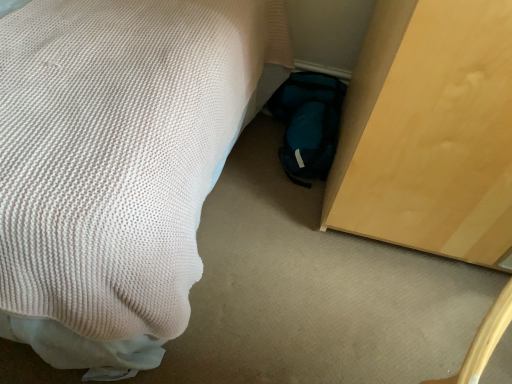
The width and height of the screenshot is (512, 384). Describe the element at coordinates (117, 166) in the screenshot. I see `white knitted bed at lower left` at that location.

Identify the location of white knitted bed at lower left. (117, 166).

What is the approximate width of white knitted bed at lower left?

white knitted bed at lower left is 1.38 meters wide.

Describe the element at coordinates (308, 123) in the screenshot. This screenshot has height=384, width=512. I see `teal fabric bag at lower center` at that location.

The width and height of the screenshot is (512, 384). What are the coordinates of `teal fabric bag at lower center` in the screenshot? It's located at (308, 123).

Where is `white knitted bed at lower left`? Image resolution: width=512 pixels, height=384 pixels. white knitted bed at lower left is located at coordinates (117, 166).

In the image, is white knitted bed at lower left on the left side or the right side of teal fabric bag at lower center?

From the image, it's evident that white knitted bed at lower left is to the left of teal fabric bag at lower center.

Is white knitted bed at lower left further to the viewer compared to teal fabric bag at lower center?

No, white knitted bed at lower left is in front of teal fabric bag at lower center.

Which is less distant, (29, 212) or (283, 159)?

Positioned in front is point (29, 212).

From the image's perspective, which one is positioned higher, white knitted bed at lower left or teal fabric bag at lower center?

white knitted bed at lower left appears higher in the image.

From a real-world perspective, is white knitted bed at lower left positioned above or below teal fabric bag at lower center?

From a real-world perspective, white knitted bed at lower left is physically above teal fabric bag at lower center.

Which object is thinner, white knitted bed at lower left or teal fabric bag at lower center?

With smaller width is teal fabric bag at lower center.

Which of these two, white knitted bed at lower left or teal fabric bag at lower center, stands taller?

With more height is white knitted bed at lower left.

Considering the relative sizes of white knitted bed at lower left and teal fabric bag at lower center in the image provided, is white knitted bed at lower left smaller than teal fabric bag at lower center?

No.

Consider the image. Is white knitted bed at lower left not within teal fabric bag at lower center?

Yes, white knitted bed at lower left is not within teal fabric bag at lower center.

Are white knitted bed at lower left and teal fabric bag at lower center located far from each other?

No.

Could you tell me if white knitted bed at lower left is facing teal fabric bag at lower center?

Yes, white knitted bed at lower left is turned towards teal fabric bag at lower center.

Identify the location of bed lying in front of the teal fabric bag at lower center. The image size is (512, 384). point(117,166).

Which object is positioned more to the left, teal fabric bag at lower center or white knitted bed at lower left?

From the viewer's perspective, white knitted bed at lower left appears more on the left side.

Is teal fabric bag at lower center positioned before white knitted bed at lower left?

No, it is behind white knitted bed at lower left.

Is point (314, 94) closer to viewer compared to point (178, 215)?

No, it is not.

From the image's perspective, who appears lower, teal fabric bag at lower center or white knitted bed at lower left?

teal fabric bag at lower center, from the image's perspective.

From a real-world perspective, which is physically below, teal fabric bag at lower center or white knitted bed at lower left?

teal fabric bag at lower center, from a real-world perspective.

Considering the relative sizes of teal fabric bag at lower center and white knitted bed at lower left in the image provided, is teal fabric bag at lower center thinner than white knitted bed at lower left?

Indeed, teal fabric bag at lower center has a lesser width compared to white knitted bed at lower left.

Is teal fabric bag at lower center taller than white knitted bed at lower left?

No, teal fabric bag at lower center is not taller than white knitted bed at lower left.

Who is smaller, teal fabric bag at lower center or white knitted bed at lower left?

With smaller size is teal fabric bag at lower center.

Does teal fabric bag at lower center contain white knitted bed at lower left?

Definitely not — white knitted bed at lower left is not inside teal fabric bag at lower center.

Is teal fabric bag at lower center touching white knitted bed at lower left?

No, teal fabric bag at lower center is not in contact with white knitted bed at lower left.

Is teal fabric bag at lower center looking in the opposite direction of white knitted bed at lower left?

No.

Can you tell me how much teal fabric bag at lower center and white knitted bed at lower left differ in facing direction?

The angular difference between teal fabric bag at lower center and white knitted bed at lower left is 94 degrees.

Locate an element on the screen. bag behind the white knitted bed at lower left is located at coordinates (308, 123).

The width and height of the screenshot is (512, 384). I want to click on bed in front of the teal fabric bag at lower center, so click(117, 166).

This screenshot has width=512, height=384. There is a teal fabric bag at lower center. Identify the location of bed above it (from a real-world perspective). (117, 166).